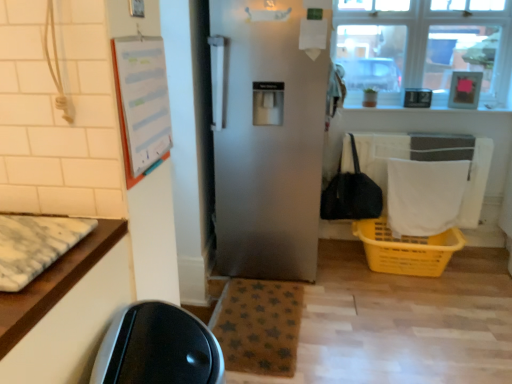
This screenshot has height=384, width=512. Identify the location of free space in front of satin silver refrigerator at center. (343, 329).